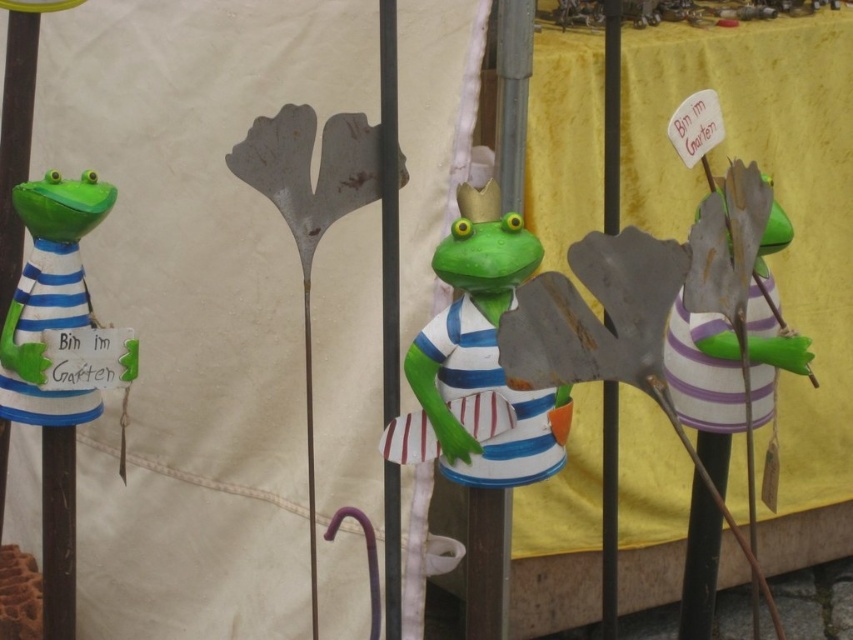
Who is positioned more to the right, matte green frog at center or green matte frog at left?

matte green frog at center is more to the right.

Can you confirm if matte green frog at center is positioned to the left of green matte frog at left?

In fact, matte green frog at center is to the right of green matte frog at left.

Which is behind, point (477, 193) or point (39, 230)?

Positioned behind is point (39, 230).

This screenshot has height=640, width=853. Identify the location of matte green frog at center. 479,360.